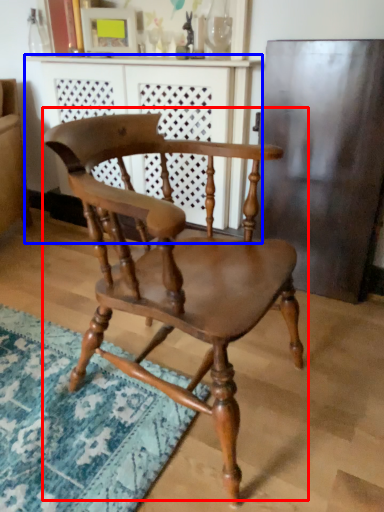
Question: Which object appears farthest to the camera in this image, chair (highlighted by a red box) or dresser (highlighted by a blue box)?

Choices:
 (A) chair
 (B) dresser

Answer: (B)